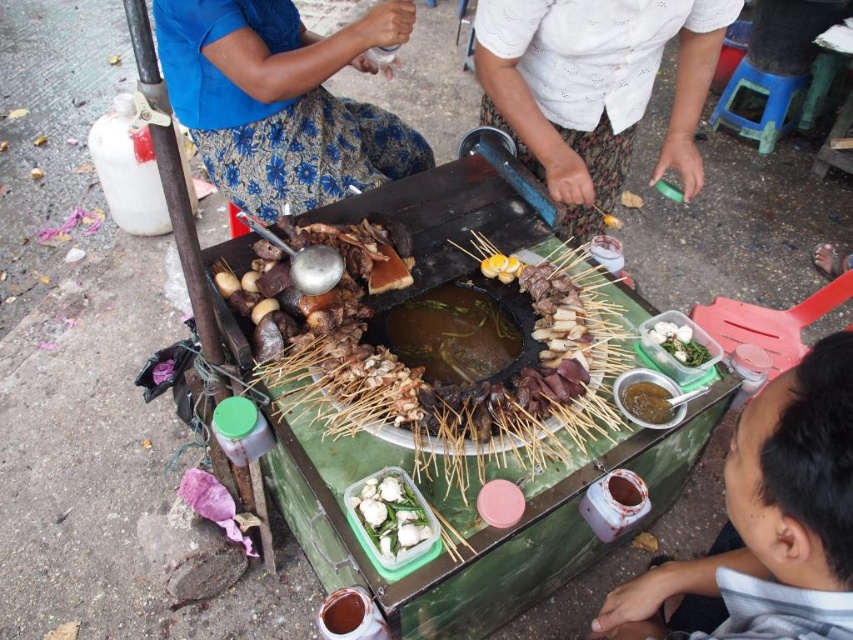
Question: Can you confirm if gray cotton shirt at lower right is positioned to the left of white glossy shell at center?

Choices:
 (A) no
 (B) yes

Answer: (A)

Question: Can you confirm if white glossy shell at center is positioned below shiny brown sauce at center?

Choices:
 (A) no
 (B) yes

Answer: (B)

Question: Does white glossy shell at center appear under shiny brown sauce at center?

Choices:
 (A) yes
 (B) no

Answer: (A)

Question: Which point appears farthest from the camera in this image?

Choices:
 (A) (422, 528)
 (B) (846, 554)
 (C) (201, 28)

Answer: (C)

Question: Estimate the real-world distances between objects in this image. Which object is closer to the shiny brown sauce at center?

Choices:
 (A) gray cotton shirt at lower right
 (B) blue floral skirt at upper left

Answer: (A)

Question: Estimate the real-world distances between objects in this image. Which object is farther from the gray cotton shirt at lower right?

Choices:
 (A) white glossy boiled eggs at center
 (B) shiny brown sauce at center
 (C) blue floral skirt at upper left
 (D) white glossy shell at center

Answer: (C)